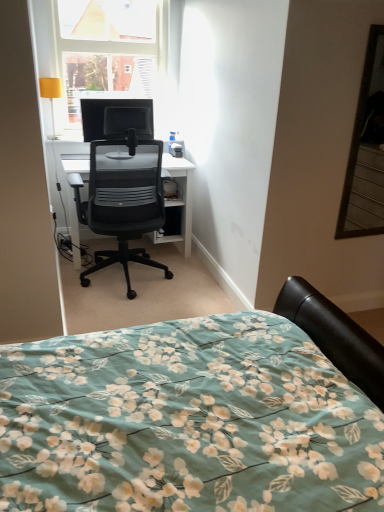
Question: Should I look upward or downward to see transparent glass window at upper left?

Choices:
 (A) up
 (B) down

Answer: (A)

Question: Can you confirm if transparent glass window at upper left is thinner than black mesh chair at center?

Choices:
 (A) yes
 (B) no

Answer: (A)

Question: From the image's perspective, would you say transparent glass window at upper left is shown under black mesh chair at center?

Choices:
 (A) no
 (B) yes

Answer: (A)

Question: Is black mesh chair at center located within transparent glass window at upper left?

Choices:
 (A) no
 (B) yes

Answer: (A)

Question: Could you tell me if transparent glass window at upper left is facing black mesh chair at center?

Choices:
 (A) yes
 (B) no

Answer: (A)

Question: From a real-world perspective, is transparent glass window at upper left positioned over black mesh chair at center based on gravity?

Choices:
 (A) yes
 (B) no

Answer: (A)

Question: Considering the relative sizes of transparent glass window at upper left and black mesh chair at center in the image provided, is transparent glass window at upper left wider than black mesh chair at center?

Choices:
 (A) yes
 (B) no

Answer: (B)

Question: From a real-world perspective, is matte black monitor at upper center physically above transparent glass window at upper left?

Choices:
 (A) yes
 (B) no

Answer: (B)

Question: Can you confirm if matte black monitor at upper center is wider than transparent glass window at upper left?

Choices:
 (A) yes
 (B) no

Answer: (B)

Question: From the image's perspective, does matte black monitor at upper center appear lower than transparent glass window at upper left?

Choices:
 (A) no
 (B) yes

Answer: (B)

Question: Does matte black monitor at upper center come behind transparent glass window at upper left?

Choices:
 (A) yes
 (B) no

Answer: (A)

Question: Is matte black monitor at upper center outside of transparent glass window at upper left?

Choices:
 (A) no
 (B) yes

Answer: (B)

Question: From the image's perspective, does matte black monitor at upper center appear higher than transparent glass window at upper left?

Choices:
 (A) yes
 (B) no

Answer: (B)

Question: Considering the relative sizes of yellow fabric lampshade at upper left and black mesh chair at center in the image provided, is yellow fabric lampshade at upper left bigger than black mesh chair at center?

Choices:
 (A) no
 (B) yes

Answer: (A)